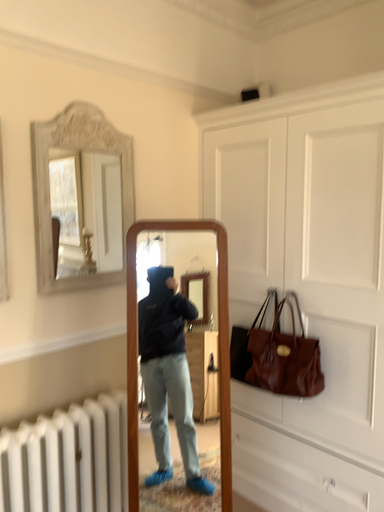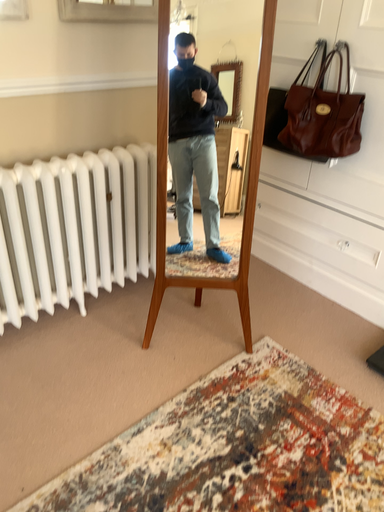
Question: Which way did the camera rotate in the video?

Choices:
 (A) rotated downward
 (B) rotated upward

Answer: (A)